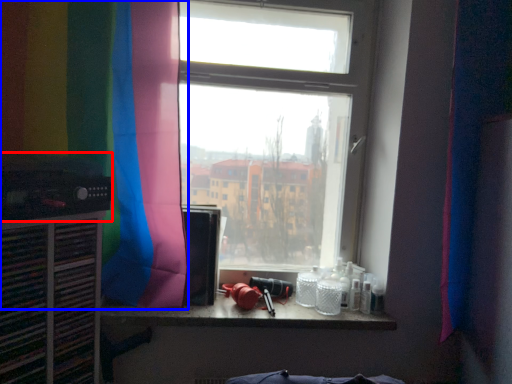
Question: Which point is further to the camera, appliance (highlighted by a red box) or curtain (highlighted by a blue box)?

Choices:
 (A) appliance
 (B) curtain

Answer: (B)